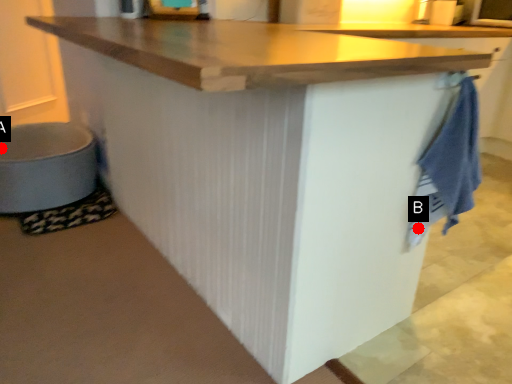
Question: Two points are circled on the image, labeled by A and B beside each circle. Among these points, which one is nearest to the camera?

Choices:
 (A) A is closer
 (B) B is closer

Answer: (B)